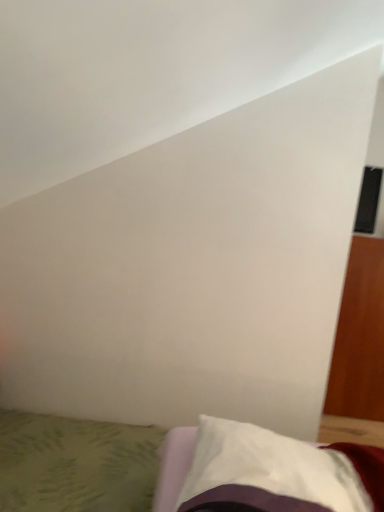
Locate an element on the screen. The width and height of the screenshot is (384, 512). vacant area on top of white fabric bed at lower center (from a real-world perspective) is located at coordinates (91, 458).